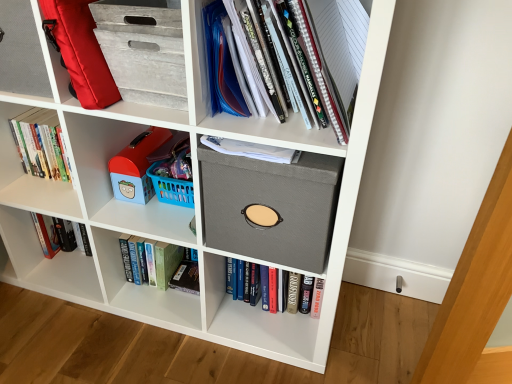
Question: Is matte plastic toy at left, which ranks as the second shelf in right-to-left order, far from matte gray folder at upper right, placed as the 2th shelf when sorted from left to right?

Choices:
 (A) yes
 (B) no

Answer: (B)

Question: Is matte plastic toy at left, which is the 1th shelf in back-to-front order, facing towards matte gray folder at upper right, placed as the 2th shelf when sorted from left to right?

Choices:
 (A) no
 (B) yes

Answer: (A)

Question: Considering the relative sizes of matte plastic toy at left, which ranks as the second shelf in right-to-left order, and matte gray folder at upper right, which appears as the 1th shelf when viewed from the front, in the image provided, is matte plastic toy at left, which ranks as the second shelf in right-to-left order, smaller than matte gray folder at upper right, which appears as the 1th shelf when viewed from the front,?

Choices:
 (A) no
 (B) yes

Answer: (B)

Question: From a real-world perspective, is matte plastic toy at left, which is the second shelf from front to back, on top of matte gray folder at upper right, placed as the 2th shelf when sorted from left to right?

Choices:
 (A) yes
 (B) no

Answer: (B)

Question: Are matte plastic toy at left, which is the 1th shelf in back-to-front order, and matte gray folder at upper right, the 2th shelf from the back, beside each other?

Choices:
 (A) yes
 (B) no

Answer: (B)

Question: Considering the relative positions of matte plastic toy at left, which is the second shelf from front to back, and matte gray folder at upper right, which is the 1th shelf in right-to-left order, in the image provided, is matte plastic toy at left, which is the second shelf from front to back, to the left of matte gray folder at upper right, which is the 1th shelf in right-to-left order, from the viewer's perspective?

Choices:
 (A) no
 (B) yes

Answer: (B)

Question: Can you confirm if gray fabric storage box at center is smaller than blue plastic toy at center-left?

Choices:
 (A) yes
 (B) no

Answer: (B)

Question: Considering the relative sizes of gray fabric storage box at center and blue plastic toy at center-left in the image provided, is gray fabric storage box at center bigger than blue plastic toy at center-left?

Choices:
 (A) no
 (B) yes

Answer: (B)

Question: Would you say gray fabric storage box at center contains blue plastic toy at center-left?

Choices:
 (A) yes
 (B) no

Answer: (B)

Question: Is gray fabric storage box at center far from blue plastic toy at center-left?

Choices:
 (A) yes
 (B) no

Answer: (B)

Question: Considering the relative positions of gray fabric storage box at center and blue plastic toy at center-left in the image provided, is gray fabric storage box at center behind blue plastic toy at center-left?

Choices:
 (A) no
 (B) yes

Answer: (A)

Question: Is gray fabric storage box at center outside of blue plastic toy at center-left?

Choices:
 (A) no
 (B) yes

Answer: (B)

Question: Would you say gray fabric storage box at center is a long distance from hardcover book at left, positioned as the 3th book in right-to-left order?

Choices:
 (A) yes
 (B) no

Answer: (B)